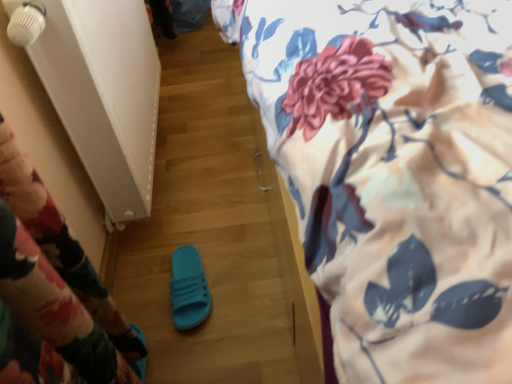
Question: In terms of width, does floral fabric bed at upper right look wider or thinner when compared to teal rubber slipper at center?

Choices:
 (A) thin
 (B) wide

Answer: (B)

Question: Is floral fabric bed at upper right in front of or behind teal rubber slipper at center in the image?

Choices:
 (A) front
 (B) behind

Answer: (A)

Question: From the image's perspective, is floral fabric bed at upper right positioned above or below teal rubber slipper at center?

Choices:
 (A) below
 (B) above

Answer: (B)

Question: Considering their positions, is teal rubber slipper at center located in front of or behind floral fabric bed at upper right?

Choices:
 (A) front
 (B) behind

Answer: (B)

Question: In terms of height, does teal rubber slipper at center look taller or shorter compared to floral fabric bed at upper right?

Choices:
 (A) tall
 (B) short

Answer: (B)

Question: In terms of width, does teal rubber slipper at center look wider or thinner when compared to floral fabric bed at upper right?

Choices:
 (A) thin
 (B) wide

Answer: (A)

Question: Is teal rubber slipper at center to the left or to the right of floral fabric bed at upper right in the image?

Choices:
 (A) left
 (B) right

Answer: (A)